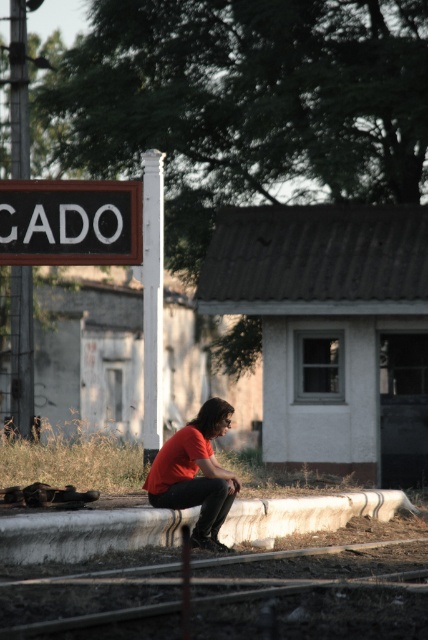
Is black painted wood sign at upper left positioned at the back of matte red shirt at center?

Yes, it is behind matte red shirt at center.

Describe the element at coordinates (70, 221) in the screenshot. I see `black painted wood sign at upper left` at that location.

Identify the location of black painted wood sign at upper left. (70, 221).

Can you confirm if smooth concrete train track at lower center is bigger than black painted wood sign at upper left?

No, smooth concrete train track at lower center is not bigger than black painted wood sign at upper left.

The height and width of the screenshot is (640, 428). What do you see at coordinates (314, 593) in the screenshot?
I see `smooth concrete train track at lower center` at bounding box center [314, 593].

Find the location of a particular element. This screenshot has width=428, height=640. smooth concrete train track at lower center is located at coordinates point(314,593).

Can you confirm if smooth concrete train track at lower center is shorter than matte red shirt at center?

Yes, smooth concrete train track at lower center is shorter than matte red shirt at center.

Between point (419, 612) and point (196, 451), which one is positioned behind?

The point (196, 451) is behind.

The width and height of the screenshot is (428, 640). What are the coordinates of `smooth concrete train track at lower center` in the screenshot? It's located at (314, 593).